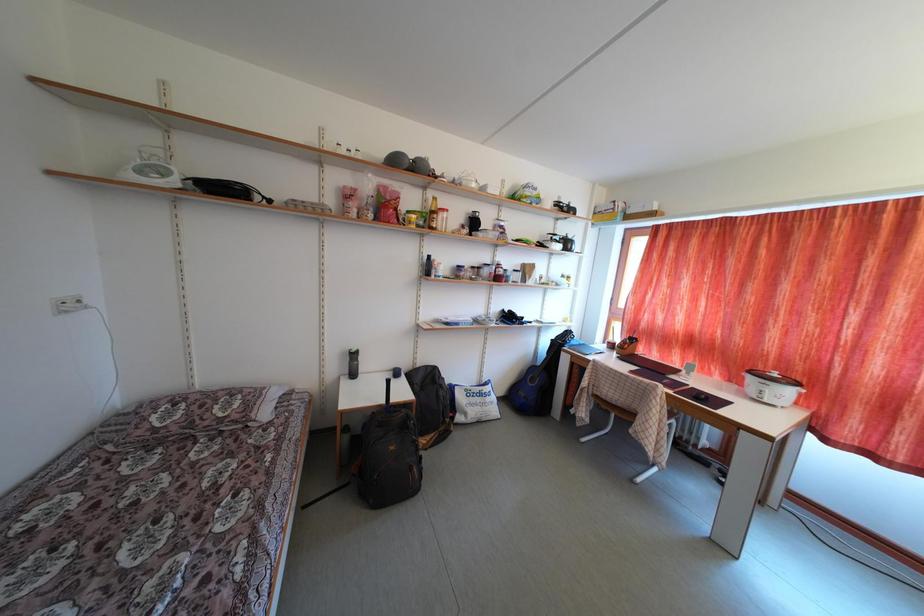
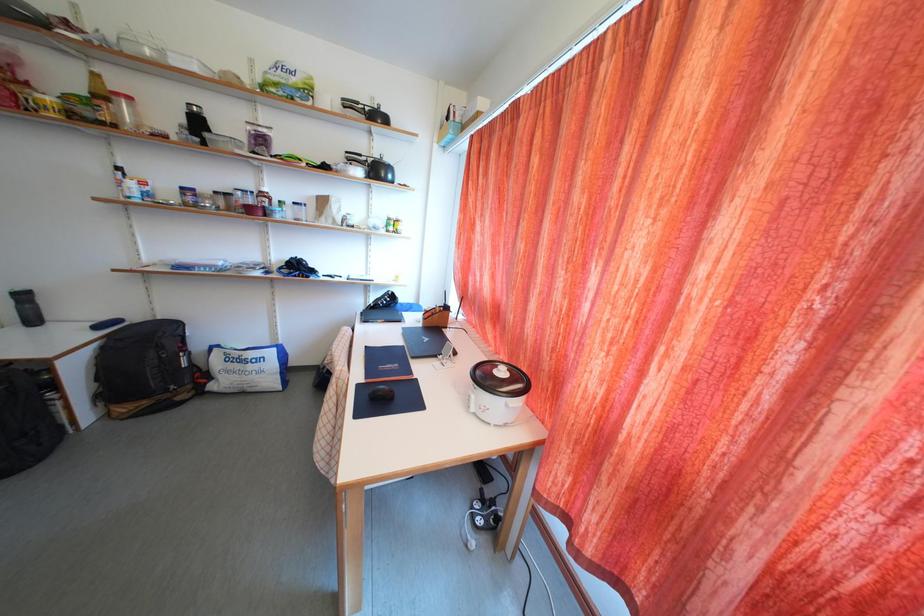
Question: The images are taken continuously from a first-person perspective. In which direction are you moving?

Choices:
 (A) Left
 (B) Right
 (C) Forward
 (D) Backward

Answer: (B)